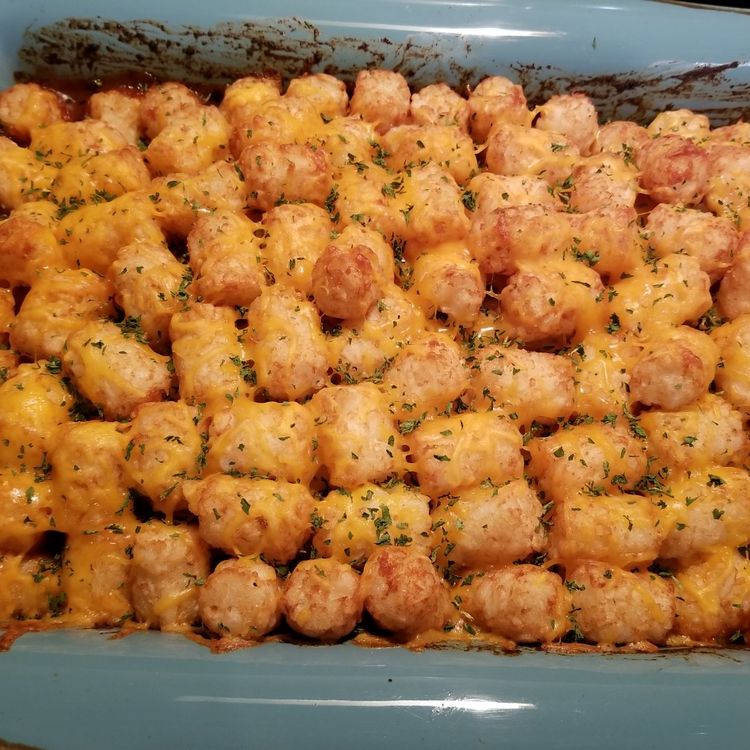
The image size is (750, 750). I want to click on green gunk inside pan, so click(141, 58).